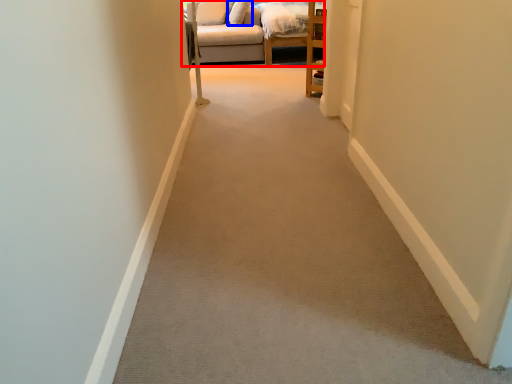
Question: Which of the following is the farthest to the observer, studio couch (highlighted by a red box) or pillow (highlighted by a blue box)?

Choices:
 (A) studio couch
 (B) pillow

Answer: (B)